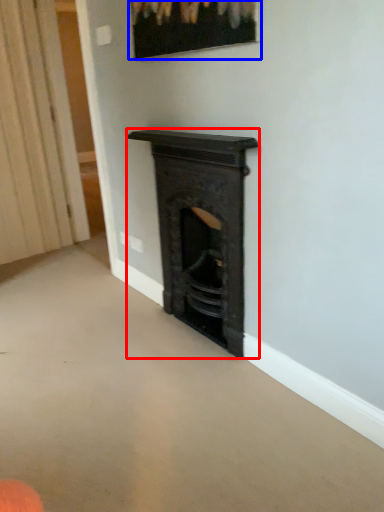
Question: Which of the following is the closest to the observer, fireplace (highlighted by a red box) or picture frame (highlighted by a blue box)?

Choices:
 (A) fireplace
 (B) picture frame

Answer: (B)